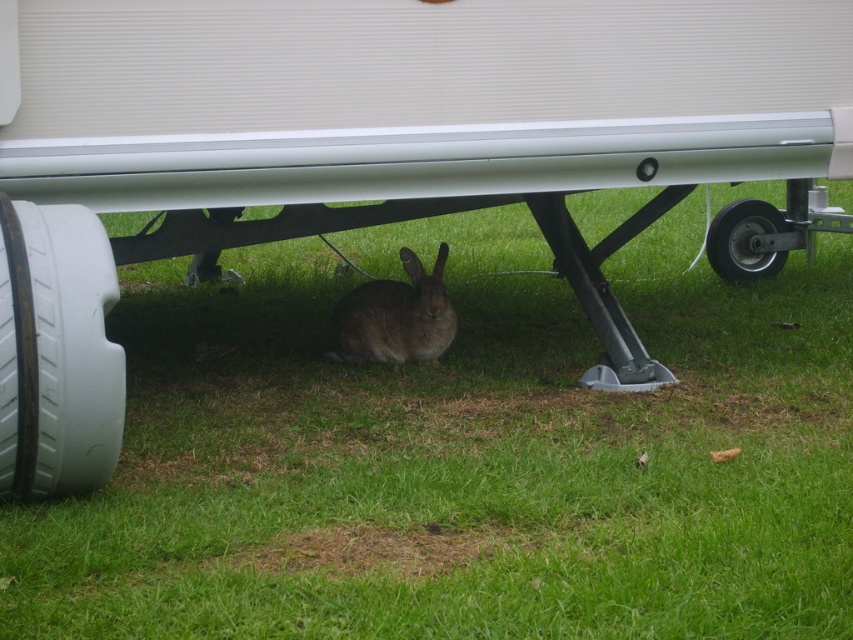
Which is more to the right, brown fur rabbit at center or black rubber tire at lower right?

From the viewer's perspective, black rubber tire at lower right appears more on the right side.

Is brown fur rabbit at center above black rubber tire at lower right?

No, brown fur rabbit at center is not above black rubber tire at lower right.

Image resolution: width=853 pixels, height=640 pixels. I want to click on brown fur rabbit at center, so click(396, 316).